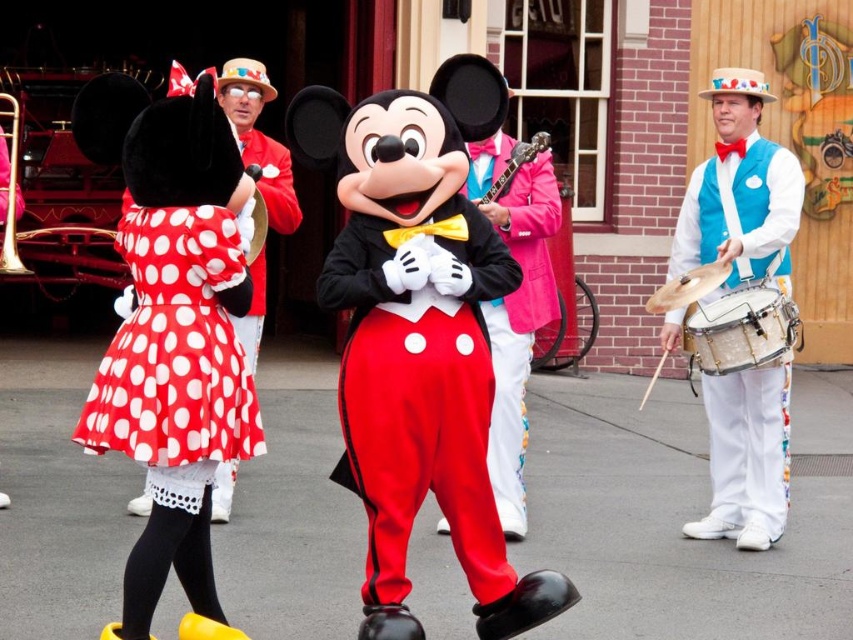
You are an event planner trying to arrange a photo shoot for the performers. You need to position a camera at the center of the image to capture both the Mickey Mouse character and the blue velvet vest at right. Based on their positions, will the camera need to be adjusted to the left or right to ensure both are in frame?

The blue velvet vest at right is located at point (740, 212), which is to the right side of the image. The Mickey Mouse character is in the foreground. To capture both, the camera should be centered, but since the vest is on the right, the camera might need slight adjustment to the left to keep both subjects within the frame.

You are an event planner looking at the image of the lively scene. You need to determine the spatial arrangement of the costumes for a stage setup. Which costume, the polka dot fabric dress at left or the white polka dot dress at center, is placed lower on the stage?

The polka dot fabric dress at left is positioned under the white polka dot dress at center, meaning it is placed lower on the stage.

You are a photographer standing at the location of the camera. You want to take a photo of the polka dot fabric dress at left. Can you reach the dress within 7 meters to adjust the lighting before taking the shot?

The polka dot fabric dress at left and camera are 6.82 meters apart from each other, so yes, you can reach the dress within 7 meters to adjust the lighting before taking the shot.